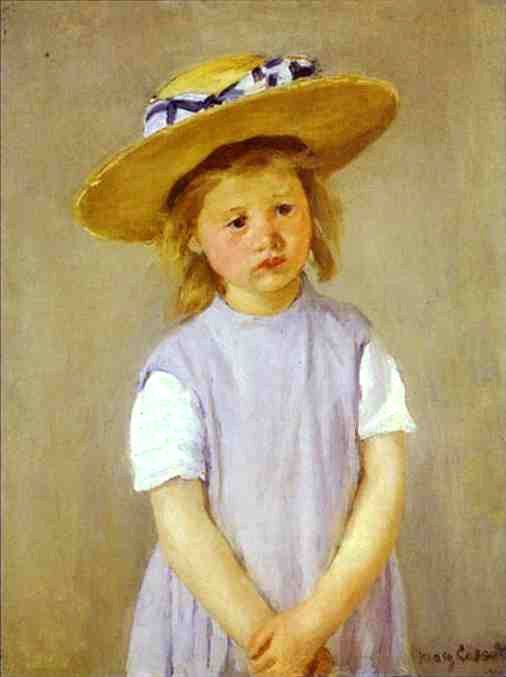
You are a GUI agent. You are given a task and a screenshot of the screen. Output one action in this format:
    pyautogui.click(x=<x>, y=<y>)
    Task: Click on the linen wrap
    The height and width of the screenshot is (677, 506).
    Given the screenshot: What is the action you would take?
    pos(182,106)